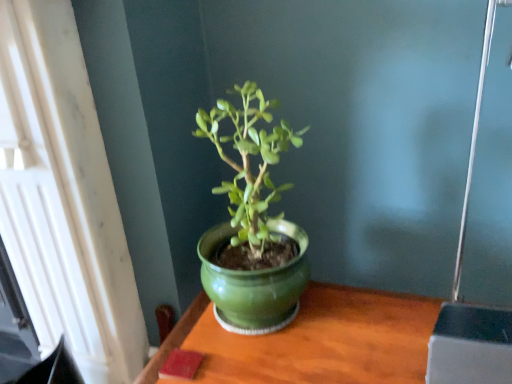
Question: Is white textured window at upper left bigger than green ceramic table at center?

Choices:
 (A) yes
 (B) no

Answer: (A)

Question: Is the depth of white textured window at upper left greater than that of green ceramic table at center?

Choices:
 (A) no
 (B) yes

Answer: (A)

Question: From the image's perspective, is white textured window at upper left located beneath green ceramic table at center?

Choices:
 (A) no
 (B) yes

Answer: (A)

Question: Is white textured window at upper left beside green ceramic table at center?

Choices:
 (A) yes
 (B) no

Answer: (B)

Question: Is white textured window at upper left smaller than green ceramic table at center?

Choices:
 (A) no
 (B) yes

Answer: (A)

Question: From the image's perspective, relative to white textured window at upper left, is glossy ceramic pot at center above or below?

Choices:
 (A) above
 (B) below

Answer: (A)

Question: In the image, is glossy ceramic pot at center on the left side or the right side of white textured window at upper left?

Choices:
 (A) right
 (B) left

Answer: (A)

Question: From their relative heights in the image, would you say glossy ceramic pot at center is taller or shorter than white textured window at upper left?

Choices:
 (A) tall
 (B) short

Answer: (B)

Question: Is glossy ceramic pot at center situated inside white textured window at upper left or outside?

Choices:
 (A) outside
 (B) inside

Answer: (A)

Question: In the image, is glossy ceramic pot at center positioned in front of or behind green ceramic table at center?

Choices:
 (A) behind
 (B) front

Answer: (A)

Question: Is glossy ceramic pot at center situated inside green ceramic table at center or outside?

Choices:
 (A) inside
 (B) outside

Answer: (B)

Question: Considering the positions of glossy ceramic pot at center and green ceramic table at center in the image, is glossy ceramic pot at center wider or thinner than green ceramic table at center?

Choices:
 (A) thin
 (B) wide

Answer: (A)

Question: Looking at the image, does glossy ceramic pot at center seem bigger or smaller compared to green ceramic table at center?

Choices:
 (A) small
 (B) big

Answer: (A)

Question: Is green ceramic table at center taller or shorter than glossy ceramic pot at center?

Choices:
 (A) short
 (B) tall

Answer: (A)

Question: Looking at their shapes, would you say green ceramic table at center is wider or thinner than glossy ceramic pot at center?

Choices:
 (A) wide
 (B) thin

Answer: (A)